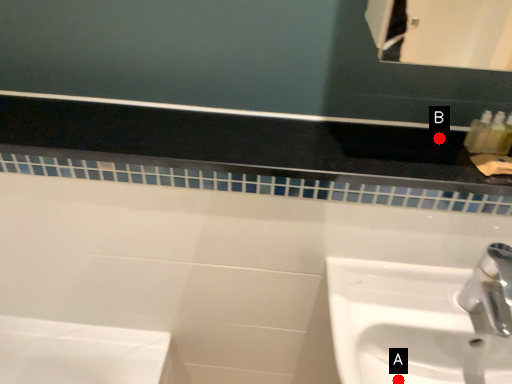
Question: Two points are circled on the image, labeled by A and B beside each circle. Which point is further to the camera?

Choices:
 (A) A is further
 (B) B is further

Answer: (B)